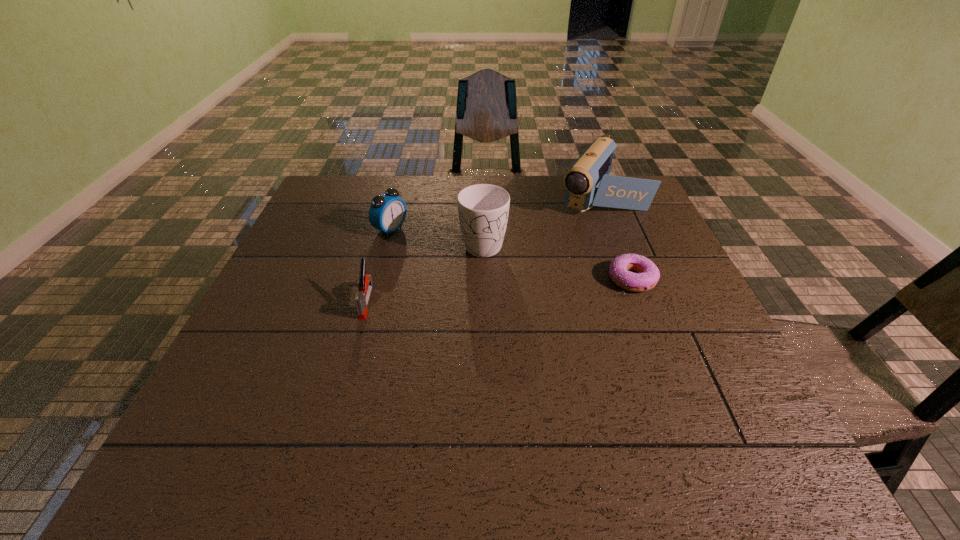
Point out which object is positioned as the fourth nearest to the camcorder. Please provide its 2D coordinates. Your answer should be formatted as a tuple, i.e. [(x, y)], where the tuple contains the x and y coordinates of a point satisfying the conditions above.

[(362, 298)]